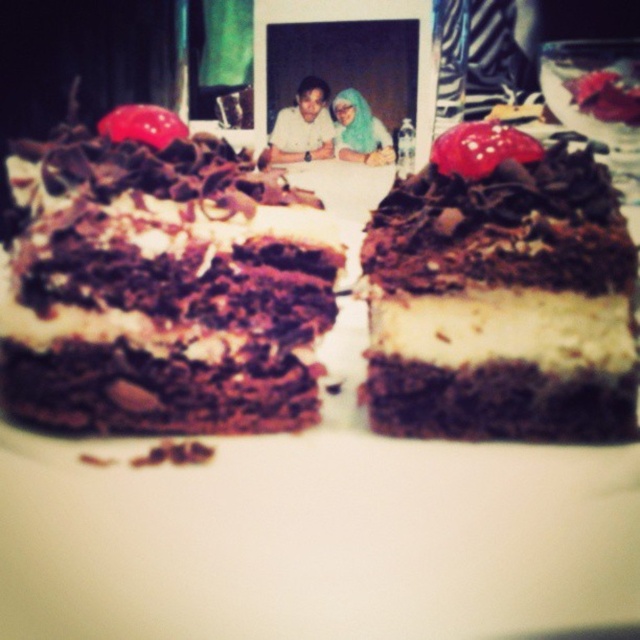
Question: Which object appears farthest from the camera in this image?

Choices:
 (A) chocolatesmoothcake at center
 (B) chocolatecrumblycake at center

Answer: (B)

Question: Can you confirm if chocolatecrumblycake at center is bigger than blue fabric headscarf at upper center?

Choices:
 (A) yes
 (B) no

Answer: (A)

Question: Which of the following is the farthest from the observer?

Choices:
 (A) (296, 154)
 (B) (195, 292)
 (C) (424, 280)

Answer: (A)

Question: Is chocolatecrumblycake at center bigger than blue fabric headscarf at upper center?

Choices:
 (A) yes
 (B) no

Answer: (A)

Question: Which point is closer to the camera?

Choices:
 (A) chocolatesmoothcake at center
 (B) matte white shirt at center

Answer: (A)

Question: Does chocolatesmoothcake at center have a smaller size compared to matte white shirt at center?

Choices:
 (A) yes
 (B) no

Answer: (B)